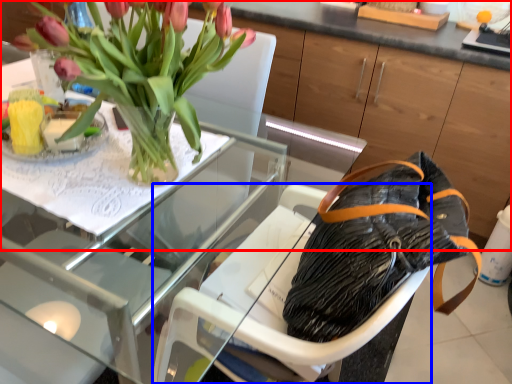
Question: Which point is closer to the camera, dresser (highlighted by a red box) or armchair (highlighted by a blue box)?

Choices:
 (A) dresser
 (B) armchair

Answer: (B)